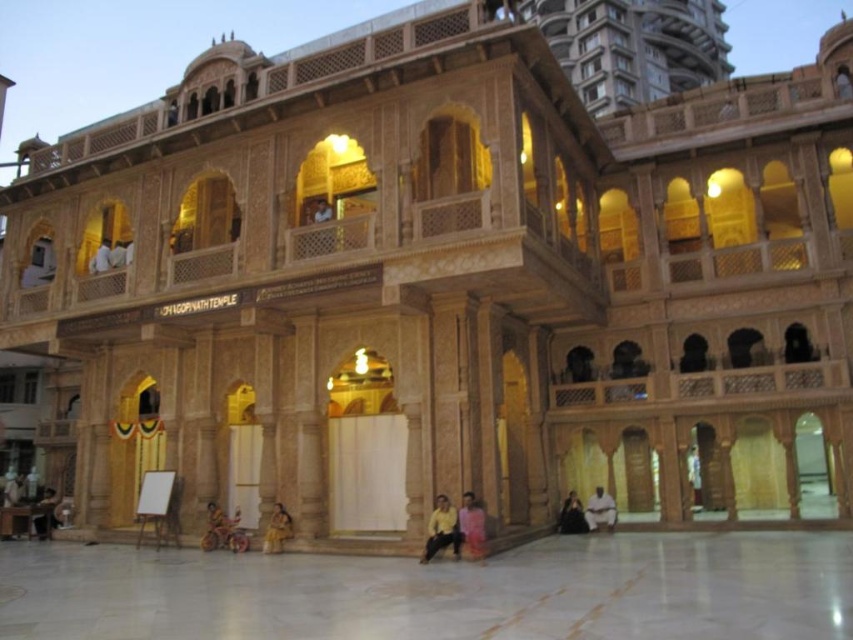
You are a visitor approaching the RUPAGOPINATH TEMPLE and notice the white marble courtyard at center and the yellow fabric cloth at lower center. Which object is elevated higher in position?

The white marble courtyard at center is elevated higher than the yellow fabric cloth at lower center as stated in the object description.

You are a visitor to the temple and see the dark skin person at lower center and the dark brown fabric at lower center in the scene. Which object is bigger in size?

The dark skin person at lower center is larger in size compared to the dark brown fabric at lower center.